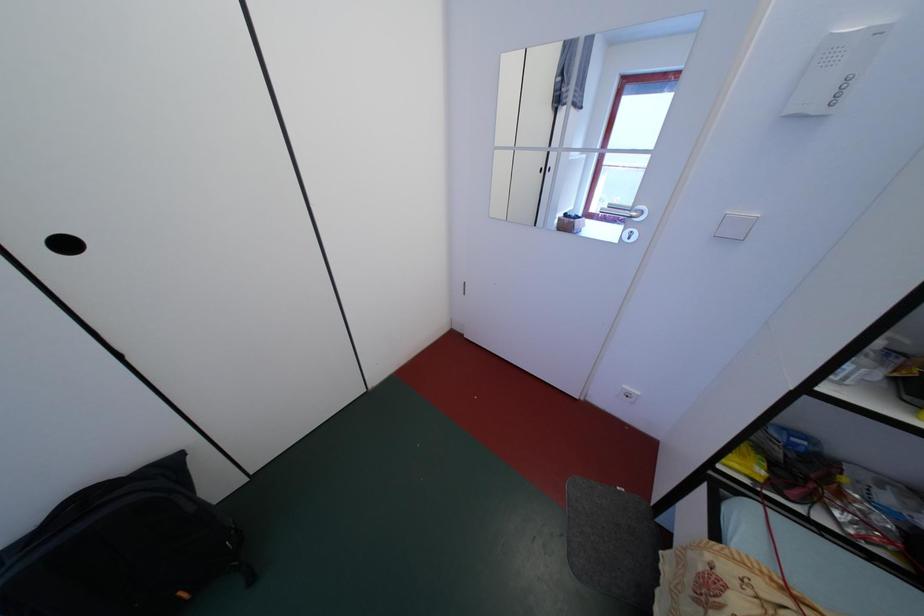
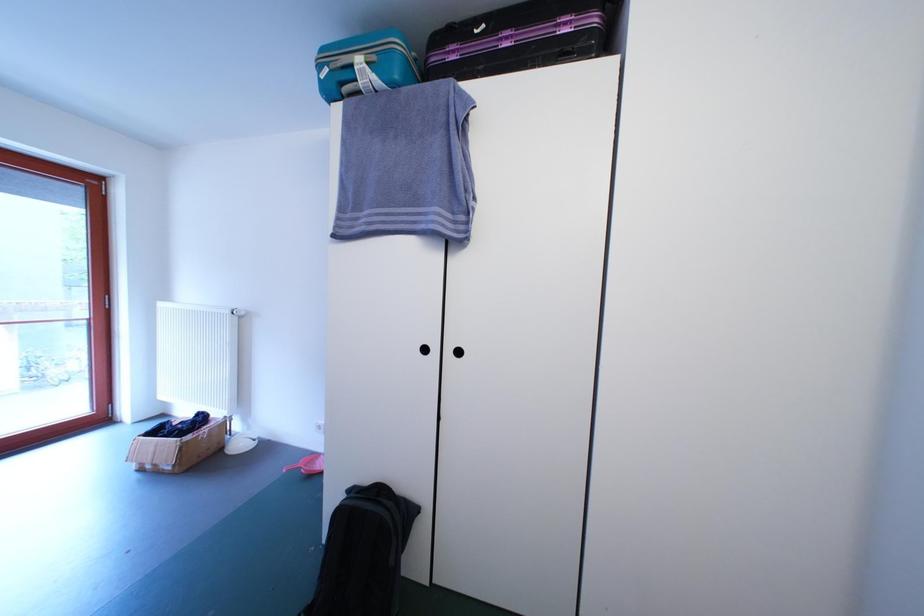
Question: How did the camera likely rotate?

Choices:
 (A) Left
 (B) Right
 (C) Up
 (D) Down

Answer: (A)